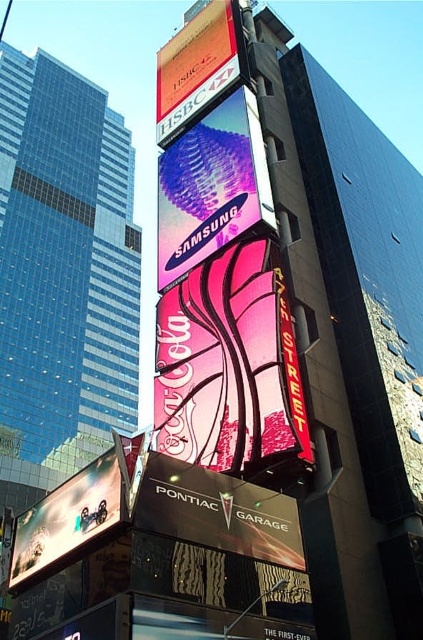
Question: Which point is closer to the camera taking this photo?

Choices:
 (A) (258, 168)
 (B) (209, 74)
 (C) (68, 529)
 (D) (198, 384)

Answer: (C)

Question: From the image, what is the correct spatial relationship of orange glossy billboard at upper center in relation to metallic silver billboard at lower left?

Choices:
 (A) above
 (B) below

Answer: (A)

Question: Does pink glossy coca-cola sign at center have a greater width compared to metallic silver billboard at lower left?

Choices:
 (A) no
 (B) yes

Answer: (B)

Question: Can you confirm if orange glossy billboard at upper center is wider than metallic silver billboard at lower left?

Choices:
 (A) no
 (B) yes

Answer: (B)

Question: Which object is the farthest from the pink glossy coca-cola sign at center?

Choices:
 (A) metallic pink samsung at center
 (B) orange glossy billboard at upper center

Answer: (B)

Question: Which object is the farthest from the orange glossy billboard at upper center?

Choices:
 (A) metallic silver billboard at lower left
 (B) pink glossy coca-cola sign at center
 (C) metallic pink samsung at center

Answer: (A)